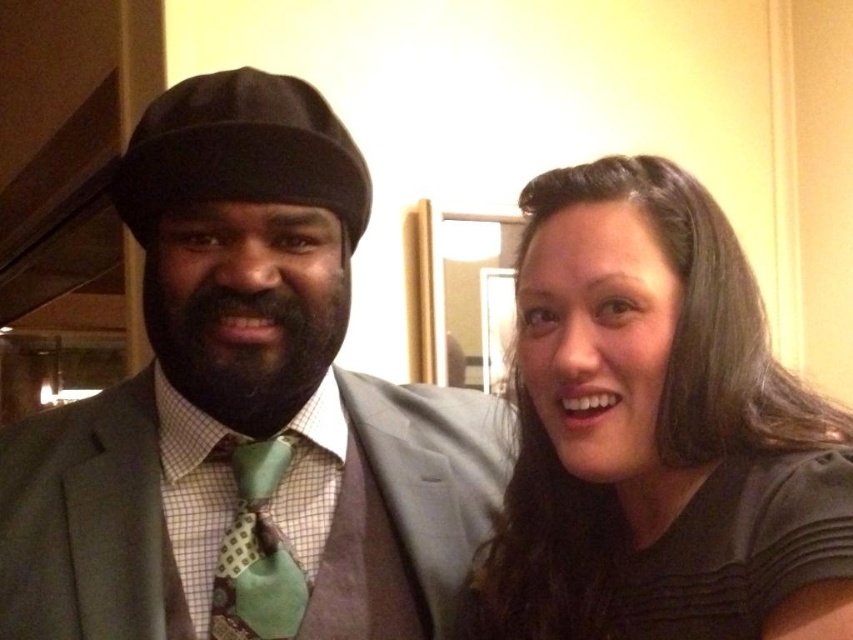
You are a photographer adjusting your camera to focus on the matte gray suit at center and the black matte hair at upper right. Which object should you focus on first to ensure proper depth of field?

You should focus on the matte gray suit at center first because it is closer to you than the black matte hair at upper right, ensuring the depth of field captures both subjects properly.

You are a photographer setting up for a group photo. You have a matte gray suit at center and a green textured tie at center in your viewfinder. Which object should you adjust your focus on if you want to ensure the wider object is in sharp focus?

The matte gray suit at center is wider than the green textured tie at center, so you should focus on the matte gray suit at center to ensure the wider object is in sharp focus.

You are a photographer adjusting your camera settings. You need to focus on the matte gray suit at center and the black fuzzy beard at center. Which one should you focus on first to ensure both are in sharp focus?

You should focus on the matte gray suit at center first because it is closer to the viewer than the black fuzzy beard at center, so adjusting focus starting from the closer object ensures both will be in sharp focus.